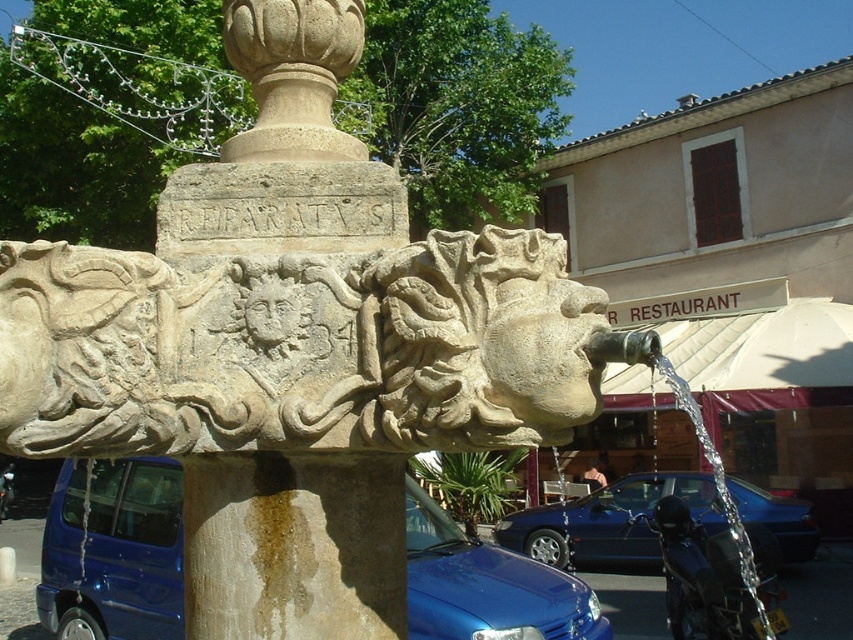
You are standing in the town square and want to take a photo of the fountain. There is a specific point at coordinates point (424, 522) that you need to focus on. If your camera can focus on objects as far as 6 meters away, will you be able to capture that point clearly?

The distance of point (424, 522) from the viewer is 6.71 meters, which is beyond the camera focus limit of 6 meters. Therefore, you won not be able to capture that point clearly.

You are standing in the town square and want to take a photo of the stone fountain with the lion head spouting water. The camera you are using has a minimum focus distance of 7 feet. Can you focus on the point at coordinates point (x=360, y=260) without moving closer?

The point at coordinates point (x=360, y=260) is 7.18 feet away from the camera. Since the camera requires a minimum focus distance of 7 feet, the point is just beyond the minimum requirement. Therefore, the camera may struggle to focus on the point at coordinates point (x=360, y=260) as it is slightly farther than the minimum focus distance.